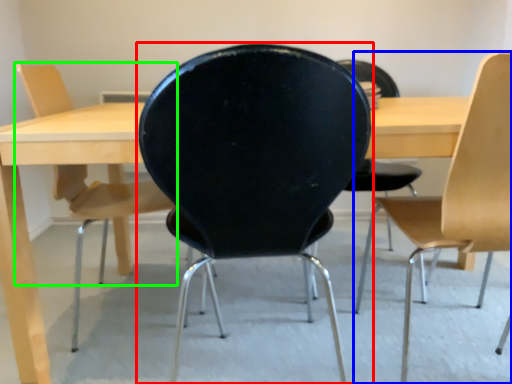
Question: Estimate the real-world distances between objects in this image. Which object is farther from chair (highlighted by a red box), chair (highlighted by a blue box) or chair (highlighted by a green box)?

Choices:
 (A) chair
 (B) chair

Answer: (B)